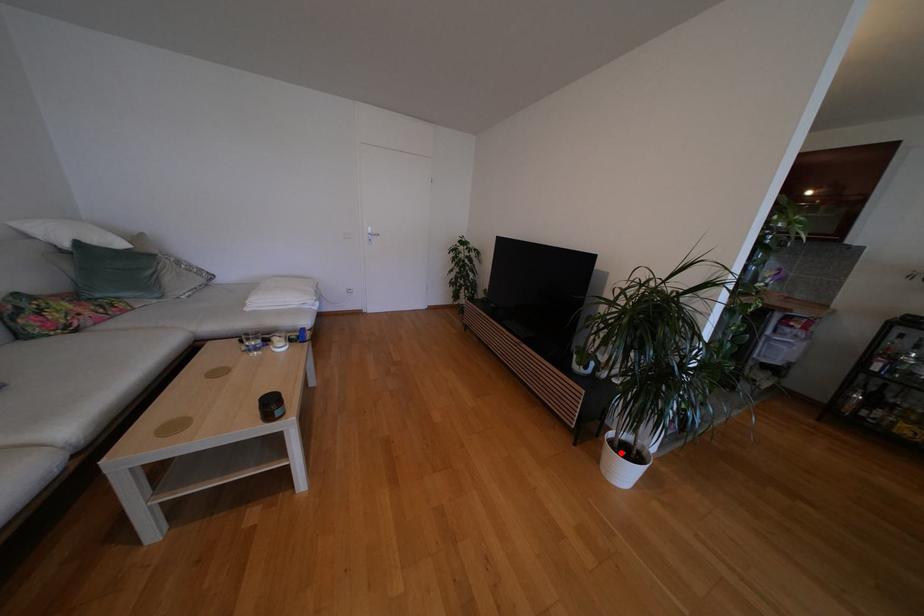
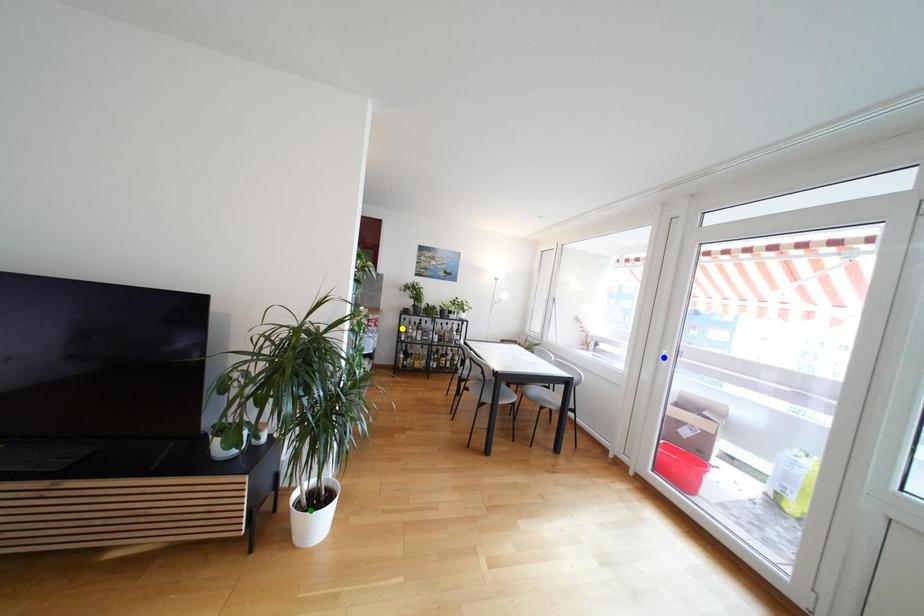
Question: I am providing you with two images of the same scene from different viewpoints. A red point is marked on the first image. You are given multiple points on the second image. Which spot in image 2 lines up with the point in image 1?

Choices:
 (A) green point
 (B) blue point
 (C) yellow point

Answer: (A)